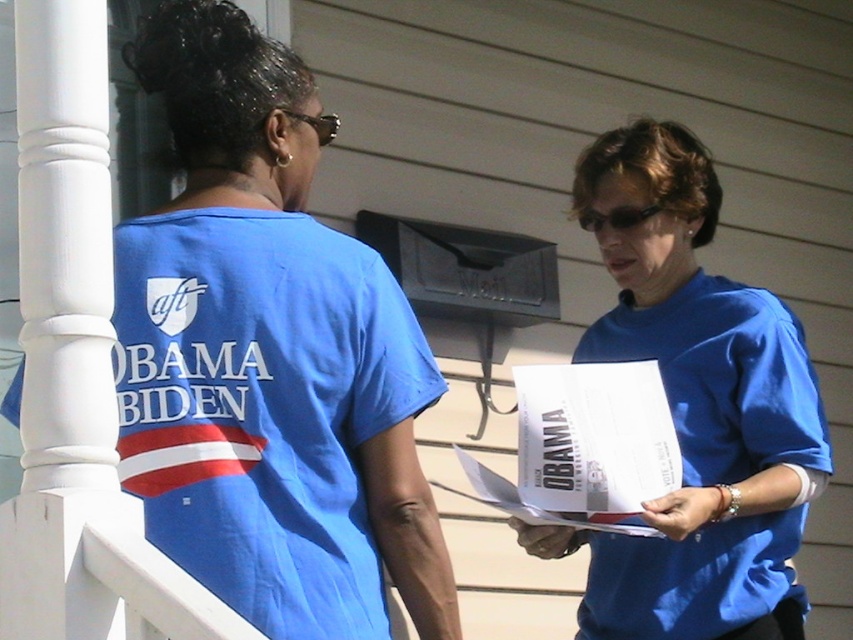
Question: Which object is farther from the camera taking this photo?

Choices:
 (A) blue fabric shirt at center
 (B) blue fabric t-shirt at upper left

Answer: (A)

Question: Among these objects, which one is farthest from the camera?

Choices:
 (A) blue fabric t-shirt at upper left
 (B) blue fabric shirt at center

Answer: (B)

Question: Which point appears closest to the camera in this image?

Choices:
 (A) (315, 422)
 (B) (674, 362)

Answer: (A)

Question: Is blue fabric t-shirt at upper left to the right of blue fabric shirt at center from the viewer's perspective?

Choices:
 (A) yes
 (B) no

Answer: (B)

Question: Can you confirm if blue fabric t-shirt at upper left is thinner than blue fabric shirt at center?

Choices:
 (A) yes
 (B) no

Answer: (A)

Question: From the image, what is the correct spatial relationship of blue fabric t-shirt at upper left in relation to blue fabric shirt at center?

Choices:
 (A) right
 (B) left

Answer: (B)